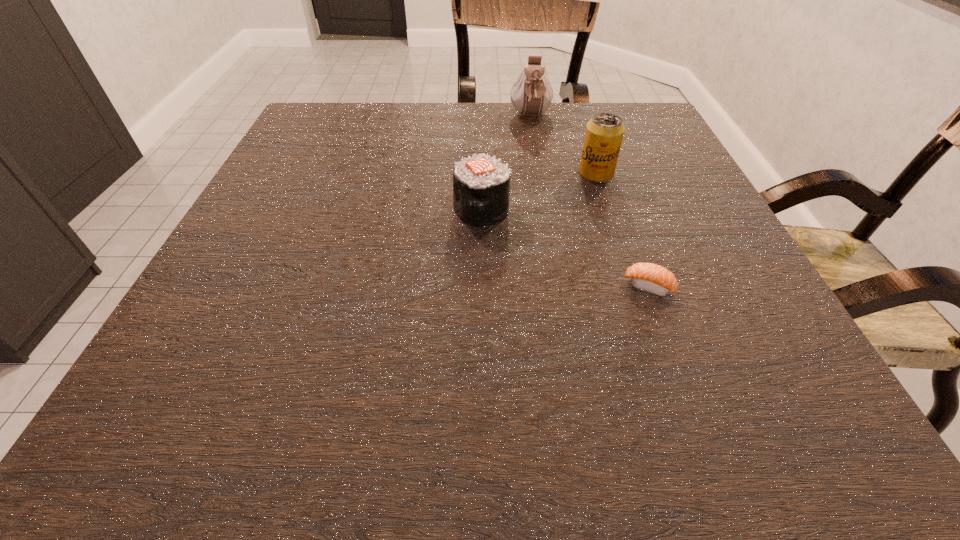
Where is `vacant space situated 0.130m on the front of the nearest object`? This screenshot has width=960, height=540. vacant space situated 0.130m on the front of the nearest object is located at coordinates (679, 370).

Locate an element on the screen. The image size is (960, 540). object at the far edge is located at coordinates (532, 93).

You are a GUI agent. You are given a task and a screenshot of the screen. Output one action in this format:
    pyautogui.click(x=<x>, y=<y>)
    Task: Click on the beer can located in the right edge section of the desktop
    This screenshot has width=960, height=540.
    Given the screenshot: What is the action you would take?
    pyautogui.click(x=604, y=133)

The image size is (960, 540). Find the location of `sushi that is at the right edge`. sushi that is at the right edge is located at coordinates (649, 277).

The width and height of the screenshot is (960, 540). Find the location of `free space at the far edge of the desktop`. free space at the far edge of the desktop is located at coordinates (495, 129).

Where is `vacant region at the near edge of the desktop`? The width and height of the screenshot is (960, 540). vacant region at the near edge of the desktop is located at coordinates (365, 384).

What are the coordinates of `vacant space at the left edge of the desktop` in the screenshot? It's located at (205, 345).

Locate an element on the screen. vacant region at the right edge of the desktop is located at coordinates [x=691, y=216].

I want to click on free space at the far left corner of the desktop, so click(339, 109).

In the image, there is a desktop. What are the coordinates of `vacant space at the far right corner` in the screenshot? It's located at (660, 145).